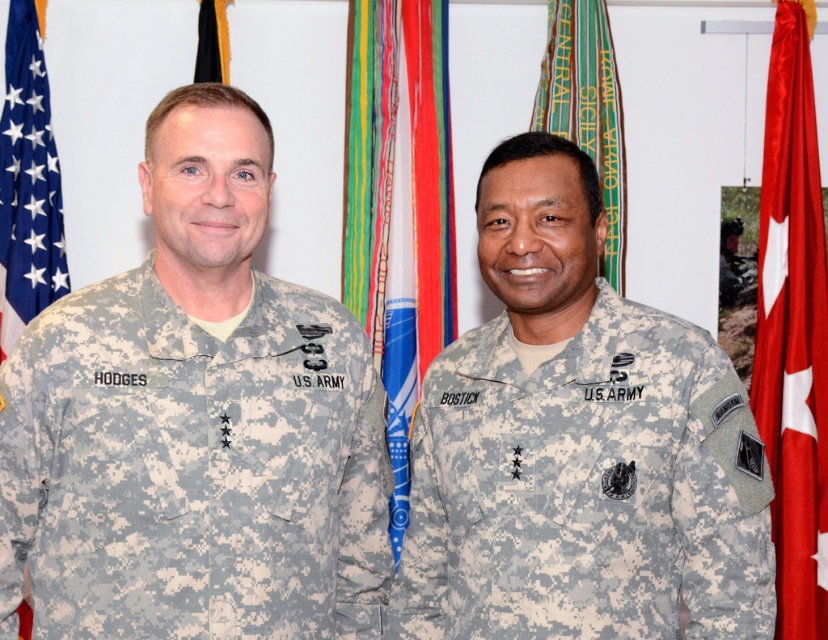
Between blue fabric flag at center and black fabric flag at upper center, which one is positioned lower?

blue fabric flag at center is below.

Which is behind, point (415, 40) or point (225, 32)?

The point (225, 32) is more distant.

This screenshot has width=828, height=640. I want to click on blue fabric flag at center, so click(x=398, y=205).

Does camouflage fabric uniform at left have a greater height compared to camouflage fabric uniform at right?

Yes.

Who is more forward, [229,540] or [461,477]?

Point [229,540] is more forward.

This screenshot has height=640, width=828. I want to click on camouflage fabric uniform at left, so click(191, 468).

Does camouflage fabric uniform at left have a larger size compared to blue fabric flag at left?

Correct, camouflage fabric uniform at left is larger in size than blue fabric flag at left.

Who is more distant from viewer, (219, 449) or (13, 252)?

The point (13, 252) is more distant.

The image size is (828, 640). Identify the location of camouflage fabric uniform at left. (191, 468).